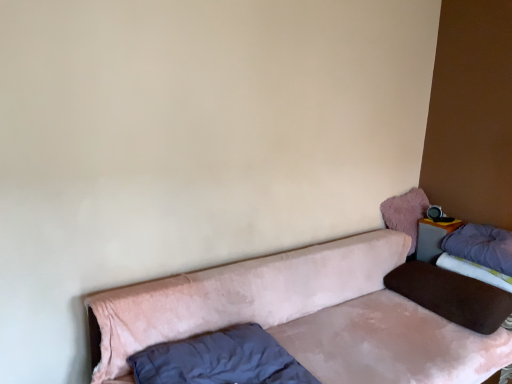
Identify the location of brown velvety pillow at right, the 3th pillow positioned from the left. (451, 295).

What do you see at coordinates (220, 360) in the screenshot? I see `velvet dark blue pillow at lower left, the fourth pillow in the right-to-left sequence` at bounding box center [220, 360].

What do you see at coordinates (474, 271) in the screenshot?
I see `velvet purple mattress at right` at bounding box center [474, 271].

Locate an element on the screen. The height and width of the screenshot is (384, 512). velvet purple mattress at right is located at coordinates (474, 271).

The width and height of the screenshot is (512, 384). I want to click on velvet pink pillow at upper right, the 2th pillow positioned from the left, so click(x=405, y=213).

From a real-world perspective, is purple soft pillow at upper right, the fourth pillow positioned from the left, physically below velvet dark blue pillow at lower left, the fourth pillow in the right-to-left sequence?

No.

Is purple soft pillow at upper right, the first pillow from the right, behind velvet dark blue pillow at lower left, the fourth pillow in the right-to-left sequence?

That is True.

Based on the photo, is purple soft pillow at upper right, the fourth pillow positioned from the left, located outside velvet dark blue pillow at lower left, the fourth pillow in the right-to-left sequence?

Indeed, purple soft pillow at upper right, the fourth pillow positioned from the left, is completely outside velvet dark blue pillow at lower left, the fourth pillow in the right-to-left sequence.

Is brown velvety pillow at right, placed as the 2th pillow when sorted from right to left, completely or partially inside matte gray table at upper right?

Result: That's incorrect, brown velvety pillow at right, placed as the 2th pillow when sorted from right to left, is not inside matte gray table at upper right.

Based on the photo, considering their positions, is matte gray table at upper right located in front of or behind brown velvety pillow at right, placed as the 2th pillow when sorted from right to left?

matte gray table at upper right is behind brown velvety pillow at right, placed as the 2th pillow when sorted from right to left.

Between point (433, 252) and point (470, 300), which one is positioned behind?

The point (433, 252) is behind.

How much distance is there between matte gray table at upper right and brown velvety pillow at right, the 3th pillow positioned from the left?

They are 15.03 inches apart.

From a real-world perspective, is velvet pink pillow at upper right, positioned as the 3th pillow in right-to-left order, beneath purple soft pillow at upper right, the fourth pillow positioned from the left?

Actually, velvet pink pillow at upper right, positioned as the 3th pillow in right-to-left order, is physically above purple soft pillow at upper right, the fourth pillow positioned from the left, in the real world.

From the image's perspective, which one is positioned lower, velvet pink pillow at upper right, the 2th pillow positioned from the left, or purple soft pillow at upper right, the first pillow from the right?

purple soft pillow at upper right, the first pillow from the right, is shown below in the image.

Is purple soft pillow at upper right, the fourth pillow positioned from the left, completely or partially inside velvet pink pillow at upper right, the 2th pillow positioned from the left?

No, purple soft pillow at upper right, the fourth pillow positioned from the left, is not surrounded by velvet pink pillow at upper right, the 2th pillow positioned from the left.

Is velvet pink pillow at upper right, the 2th pillow positioned from the left, not close to purple soft pillow at upper right, the first pillow from the right?

Actually, velvet pink pillow at upper right, the 2th pillow positioned from the left, and purple soft pillow at upper right, the first pillow from the right, are a little close together.

Is matte gray table at upper right a part of velvet purple mattress at right?

No, matte gray table at upper right is not surrounded by velvet purple mattress at right.

Does velvet purple mattress at right appear on the left side of matte gray table at upper right?

No.

Where is `mattress on the right of matte gray table at upper right`? This screenshot has height=384, width=512. mattress on the right of matte gray table at upper right is located at coordinates (474, 271).

Is velvet purple mattress at right far from velvet pink pillow at upper right, positioned as the 3th pillow in right-to-left order?

velvet purple mattress at right is actually quite close to velvet pink pillow at upper right, positioned as the 3th pillow in right-to-left order.

Is the depth of velvet purple mattress at right greater than that of velvet pink pillow at upper right, the 2th pillow positioned from the left?

No, velvet purple mattress at right is in front of velvet pink pillow at upper right, the 2th pillow positioned from the left.

Is velvet purple mattress at right positioned with its back to velvet pink pillow at upper right, positioned as the 3th pillow in right-to-left order?

No, velvet pink pillow at upper right, positioned as the 3th pillow in right-to-left order, is not at the back of velvet purple mattress at right.

From the image's perspective, is matte gray table at upper right below velvet dark blue pillow at lower left, the 1th pillow viewed from the left?

No, from the image's perspective, matte gray table at upper right is not beneath velvet dark blue pillow at lower left, the 1th pillow viewed from the left.

Can you tell me how much matte gray table at upper right and velvet dark blue pillow at lower left, the 1th pillow viewed from the left, differ in facing direction?

The angular difference between matte gray table at upper right and velvet dark blue pillow at lower left, the 1th pillow viewed from the left, is 87.5 degrees.

Is matte gray table at upper right with velvet dark blue pillow at lower left, the fourth pillow in the right-to-left sequence?

No, matte gray table at upper right is not touching velvet dark blue pillow at lower left, the fourth pillow in the right-to-left sequence.

Which is more to the right, matte gray table at upper right or velvet dark blue pillow at lower left, the fourth pillow in the right-to-left sequence?

Positioned to the right is matte gray table at upper right.

Based on their sizes in the image, would you say velvet purple mattress at right is bigger or smaller than purple soft pillow at upper right, the fourth pillow positioned from the left?

Considering their sizes, velvet purple mattress at right takes up less space than purple soft pillow at upper right, the fourth pillow positioned from the left.

Can you confirm if velvet purple mattress at right is shorter than purple soft pillow at upper right, the fourth pillow positioned from the left?

Yes, velvet purple mattress at right is shorter than purple soft pillow at upper right, the fourth pillow positioned from the left.

Is velvet purple mattress at right at the right side of purple soft pillow at upper right, the fourth pillow positioned from the left?

In fact, velvet purple mattress at right is to the left of purple soft pillow at upper right, the fourth pillow positioned from the left.

This screenshot has height=384, width=512. There is a purple soft pillow at upper right, the first pillow from the right. What are the coordinates of `the 2nd pillow below it (from the image's perspective)` in the screenshot? It's located at (220, 360).

There is a matte gray table at upper right. Identify the location of the 1st pillow below it (from a real-world perspective). (451, 295).

Based on their spatial positions, is purple soft pillow at upper right, the first pillow from the right, or velvet pink pillow at upper right, positioned as the 3th pillow in right-to-left order, closer to velvet purple mattress at right?

Among the two, purple soft pillow at upper right, the first pillow from the right, is located nearer to velvet purple mattress at right.

Based on their spatial positions, is velvet dark blue pillow at lower left, the fourth pillow in the right-to-left sequence, or velvet purple mattress at right closer to velvet pink couch at lower center?

velvet dark blue pillow at lower left, the fourth pillow in the right-to-left sequence, is closer to velvet pink couch at lower center.

Which object lies nearer to the anchor point velvet pink couch at lower center, velvet purple mattress at right or matte gray table at upper right?

The object closer to velvet pink couch at lower center is velvet purple mattress at right.

From the image, which object appears to be nearer to purple soft pillow at upper right, the first pillow from the right, velvet purple mattress at right or velvet dark blue pillow at lower left, the 1th pillow viewed from the left?

velvet purple mattress at right is positioned closer to the anchor purple soft pillow at upper right, the first pillow from the right.

From the image, which object appears to be nearer to purple soft pillow at upper right, the fourth pillow positioned from the left, velvet dark blue pillow at lower left, the 1th pillow viewed from the left, or velvet pink pillow at upper right, positioned as the 3th pillow in right-to-left order?

Based on the image, velvet pink pillow at upper right, positioned as the 3th pillow in right-to-left order, appears to be nearer to purple soft pillow at upper right, the fourth pillow positioned from the left.

Based on their spatial positions, is velvet dark blue pillow at lower left, the 1th pillow viewed from the left, or brown velvety pillow at right, placed as the 2th pillow when sorted from right to left, further from matte gray table at upper right?

The object further to matte gray table at upper right is velvet dark blue pillow at lower left, the 1th pillow viewed from the left.

Which object lies further to the anchor point brown velvety pillow at right, placed as the 2th pillow when sorted from right to left, purple soft pillow at upper right, the fourth pillow positioned from the left, or velvet pink pillow at upper right, the 2th pillow positioned from the left?

The object further to brown velvety pillow at right, placed as the 2th pillow when sorted from right to left, is velvet pink pillow at upper right, the 2th pillow positioned from the left.

Considering their positions, is velvet purple mattress at right positioned closer to velvet pink couch at lower center than brown velvety pillow at right, placed as the 2th pillow when sorted from right to left?

The object closer to velvet pink couch at lower center is brown velvety pillow at right, placed as the 2th pillow when sorted from right to left.

Identify the location of mattress between velvet dark blue pillow at lower left, the 1th pillow viewed from the left, and velvet pink pillow at upper right, the 2th pillow positioned from the left, in the front-back direction. This screenshot has width=512, height=384. (474, 271).

Locate an element on the screen. Image resolution: width=512 pixels, height=384 pixels. pillow positioned between brown velvety pillow at right, placed as the 2th pillow when sorted from right to left, and velvet pink pillow at upper right, the 2th pillow positioned from the left, from near to far is located at coordinates (481, 246).

The width and height of the screenshot is (512, 384). I want to click on table located between velvet purple mattress at right and velvet pink pillow at upper right, positioned as the 3th pillow in right-to-left order, in the depth direction, so click(433, 237).

Find the location of `pillow located between brown velvety pillow at right, placed as the 2th pillow when sorted from right to left, and matte gray table at upper right in the depth direction`. pillow located between brown velvety pillow at right, placed as the 2th pillow when sorted from right to left, and matte gray table at upper right in the depth direction is located at coordinates (481, 246).